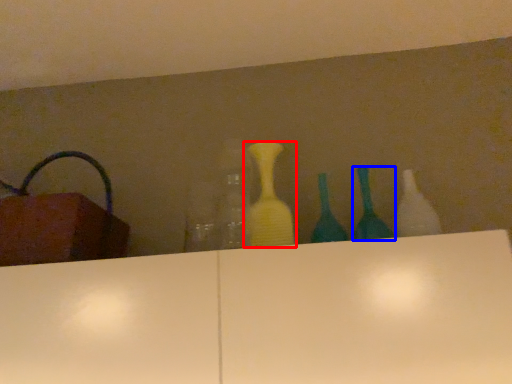
Question: Which point is further to the camera, bottle (highlighted by a red box) or bottle (highlighted by a blue box)?

Choices:
 (A) bottle
 (B) bottle

Answer: (A)